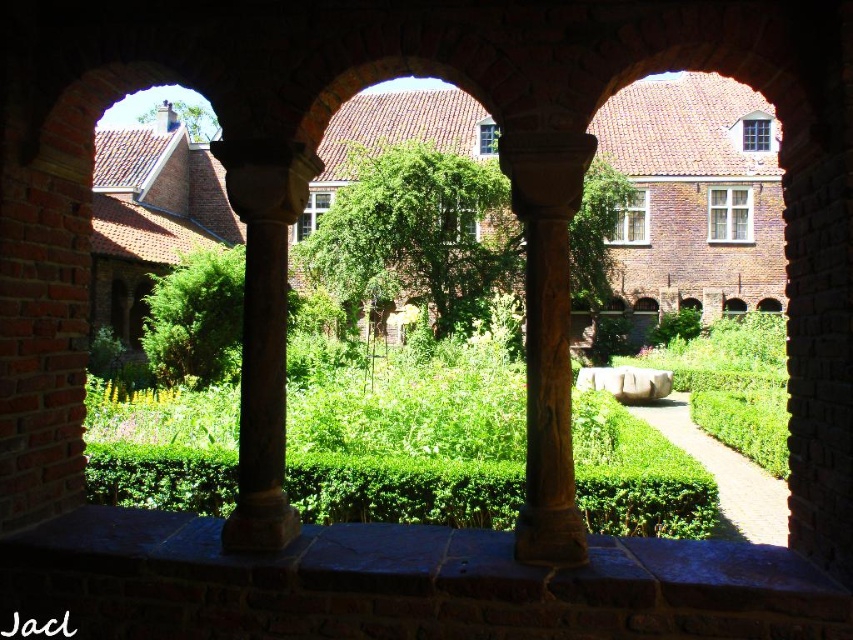
You are standing in the courtyard and want to know the position of the green leafy hedge at center and the green leafy tree at center. Which one is higher up in the image?

The green leafy hedge at center is located below the green leafy tree at center, so the tree is higher up in the image.

You are planning to install a small bench in the courtyard between the green leafy tree at center and the brown carved column at center. If the bench requires 3 meters of space, can it fit comfortably between them?

The distance between the green leafy tree at center and the brown carved column at center is 6.23 meters. Since the bench needs 3 meters of space, it can comfortably fit between them as there is enough space available.

You are a gardener planning to place a new decorative statue that is 2 meters wide in the courtyard. You have to choose between placing it next to the green leafy tree at center or the brown carved column at center. Based on their widths, which location would allow the statue to fit better without overcrowding the space?

The green leafy tree at center has a greater width than the brown carved column at center. Therefore, placing the statue next to the green leafy tree at center would provide more space, as the tree is wider and likely has a larger surrounding area, reducing overcrowding.